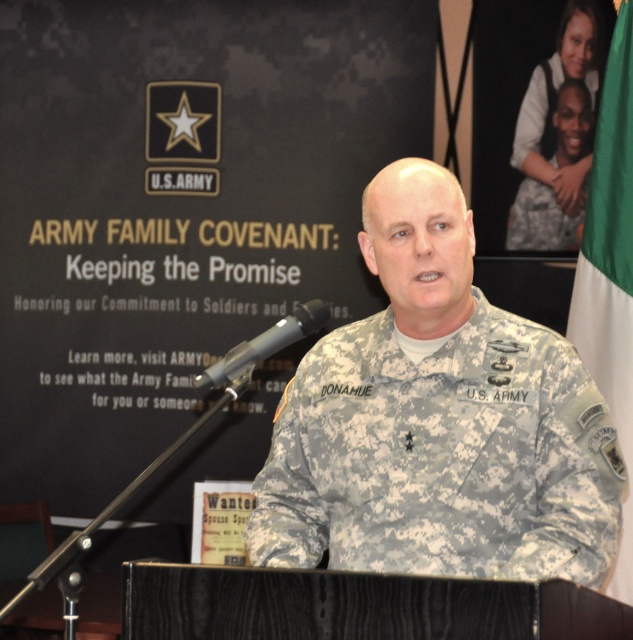
Question: Considering the real-world distances, which object is farthest from the green fabric flag at right?

Choices:
 (A) camouflage uniform at upper right
 (B) camouflage fabric uniform at center

Answer: (B)

Question: Which point appears farthest from the camera in this image?

Choices:
 (A) (596, 228)
 (B) (530, 198)
 (C) (370, 394)

Answer: (B)

Question: Does camouflage fabric uniform at center appear on the left side of green fabric flag at right?

Choices:
 (A) yes
 (B) no

Answer: (A)

Question: Which of these objects is positioned farthest from the camouflage uniform at upper right?

Choices:
 (A) camouflage fabric uniform at center
 (B) green fabric flag at right

Answer: (A)

Question: Observing the image, what is the correct spatial positioning of camouflage fabric uniform at center in reference to green fabric flag at right?

Choices:
 (A) below
 (B) above

Answer: (A)

Question: Considering the relative positions of camouflage fabric uniform at center and green fabric flag at right in the image provided, where is camouflage fabric uniform at center located with respect to green fabric flag at right?

Choices:
 (A) left
 (B) right

Answer: (A)